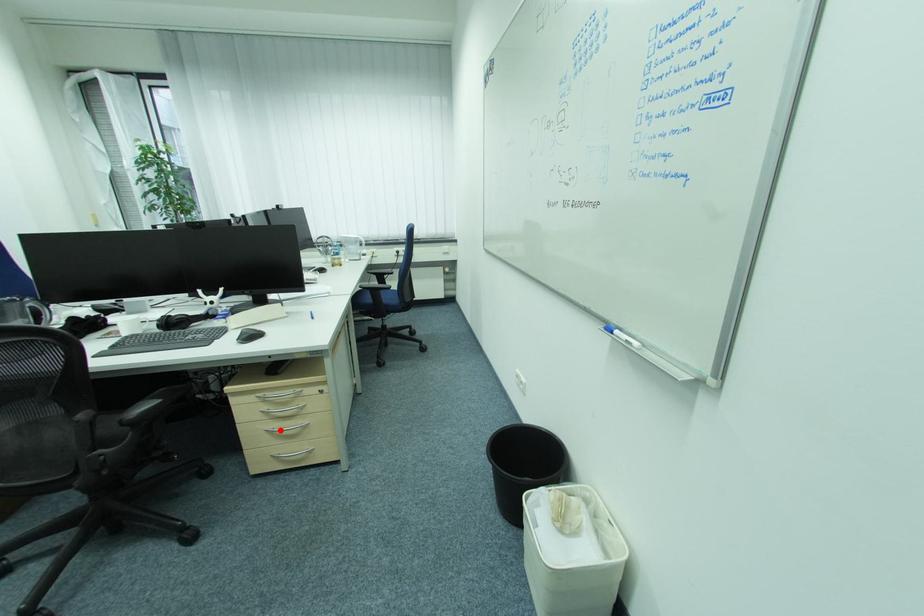
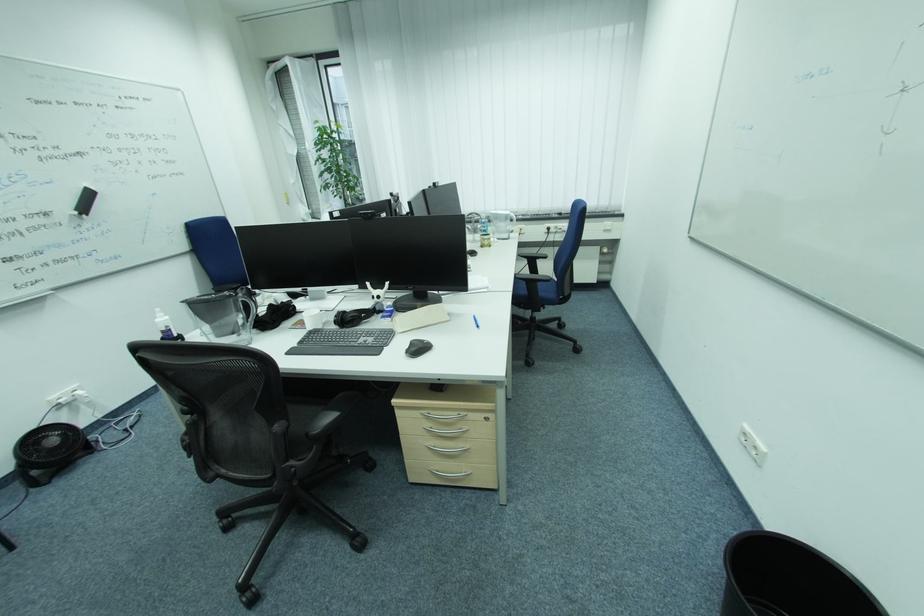
Question: I am providing you with two images of the same scene from different viewpoints. In image1, a red point is highlighted. Considering the same 3D point in image2, which of the following is correct?

Choices:
 (A) It is closer
 (B) It is farther

Answer: (B)